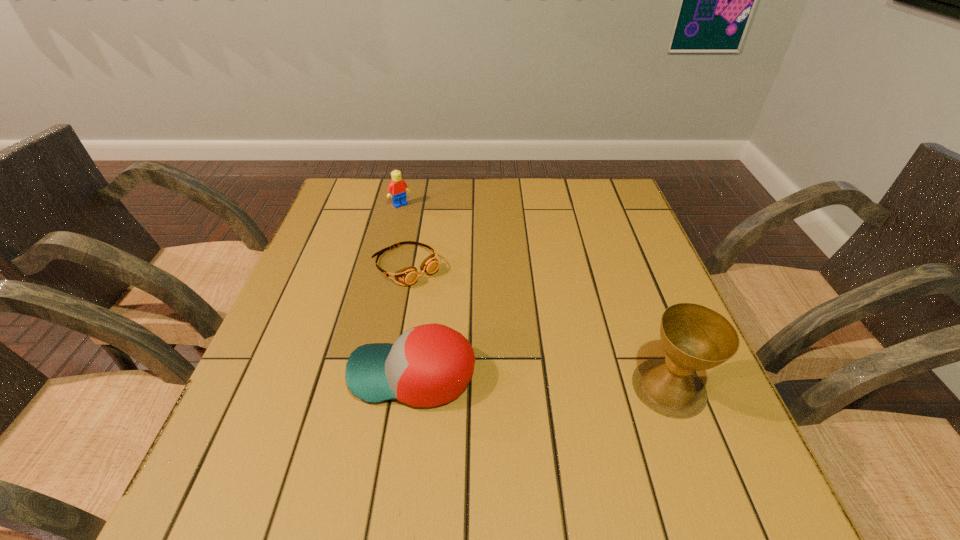
The width and height of the screenshot is (960, 540). Find the location of `object that is at the near right corner`. object that is at the near right corner is located at coordinates (694, 337).

Image resolution: width=960 pixels, height=540 pixels. In order to click on free space at the far edge of the desktop in this screenshot , I will do `click(536, 199)`.

Find the location of a particular element. This screenshot has width=960, height=540. vacant area at the left edge of the desktop is located at coordinates (371, 228).

Locate an element on the screen. This screenshot has height=540, width=960. free region at the right edge of the desktop is located at coordinates (648, 321).

In the image, there is a desktop. Find the location of `vacant space at the far left corner`. vacant space at the far left corner is located at coordinates (368, 197).

In the image, there is a desktop. At what (x,y) coordinates should I click in order to perform the action: click on vacant space at the far right corner. Please return your answer as a coordinate pair (x, y). The image size is (960, 540). Looking at the image, I should click on (611, 183).

In the image, there is a desktop. Where is `free region at the near right corner`? free region at the near right corner is located at coordinates (699, 419).

I want to click on unoccupied area between the third nearest object and the tallest object, so click(538, 327).

The height and width of the screenshot is (540, 960). In order to click on free space between the rightmost object and the baseball cap in this screenshot , I will do `click(540, 381)`.

Identify the location of free point between the second farthest object and the rightmost object. The width and height of the screenshot is (960, 540). (538, 327).